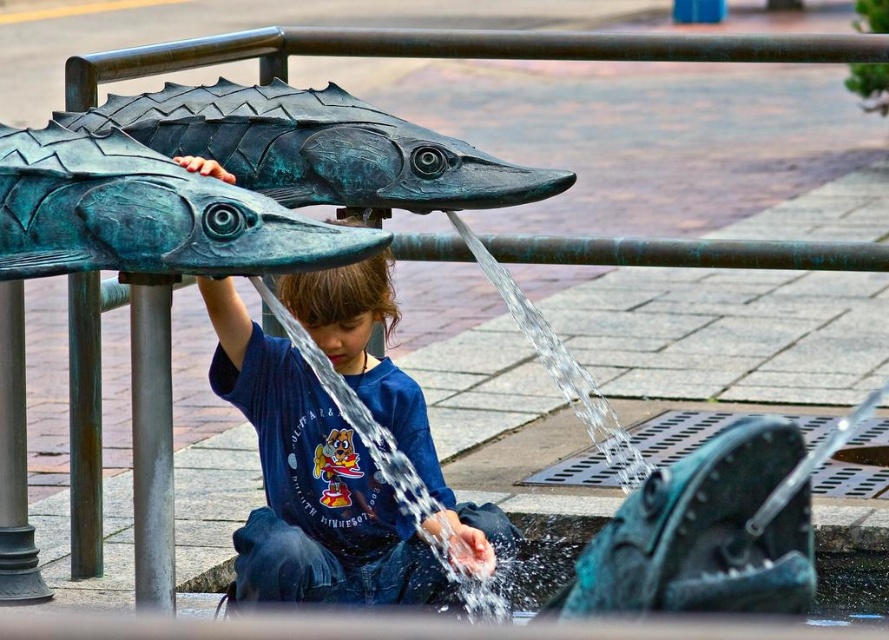
You are a parent watching your child at the water feature. Your child is wearing a matte blue shirt at center. Which direction should you move to get closer to your child while staying near the green patina bronze fish at upper left?

The matte blue shirt at center is to the right of the green patina bronze fish at upper left. To get closer to your child, you should move to the right from the green patina bronze fish at upper left.

The scene shows a child interacting with a water feature shaped like fish heads. The child is wearing a dark blue T shirt with a cartoon character and text. There is a point marked at coordinates (310, 483). What object is located at this point?

The point at (310, 483) indicates the matte blue shirt at center.